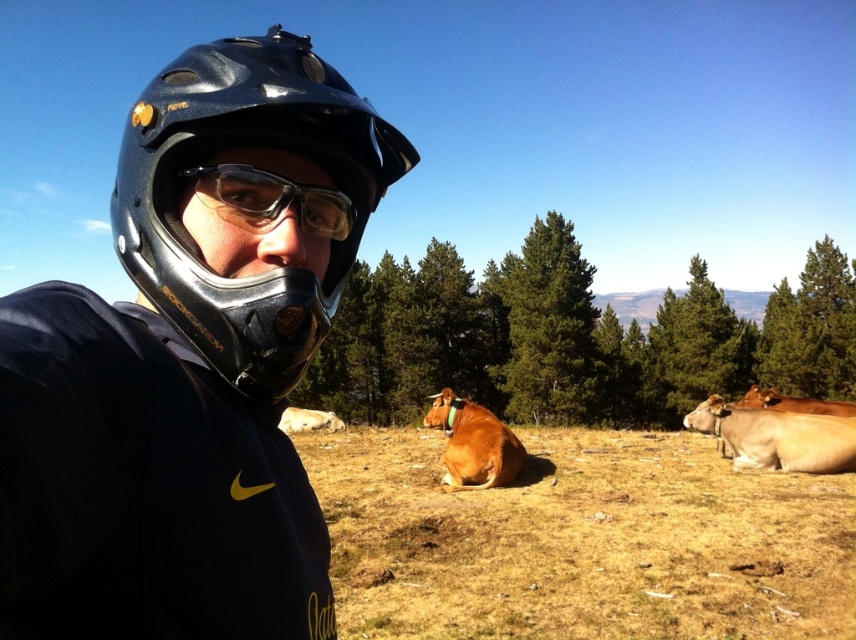
Question: Which point is farther to the camera?

Choices:
 (A) transparent plastic goggles at center
 (B) brown leather cow at center
 (C) black matte helmet at left

Answer: (B)

Question: Which object appears closest to the camera in this image?

Choices:
 (A) transparent plastic goggles at center
 (B) brown smooth cow at lower right
 (C) brown leather cow at right

Answer: (A)

Question: Does transparent plastic goggles at center have a smaller size compared to brown leather cow at right?

Choices:
 (A) no
 (B) yes

Answer: (B)

Question: Does black matte helmet at left appear on the left side of white fur at center?

Choices:
 (A) no
 (B) yes

Answer: (A)

Question: Considering the relative positions of transparent plastic goggles at center and white fur at center in the image provided, where is transparent plastic goggles at center located with respect to white fur at center?

Choices:
 (A) below
 (B) above

Answer: (B)

Question: Which point is closer to the camera?

Choices:
 (A) click(x=845, y=401)
 (B) click(x=233, y=435)
 (C) click(x=221, y=198)

Answer: (B)